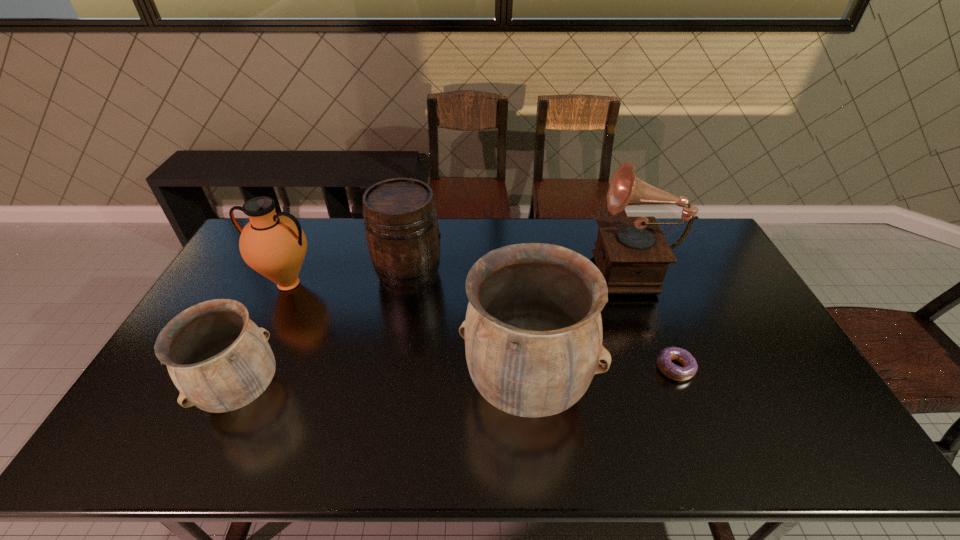
At what (x,y) coordinates should I click in order to perform the action: click on vacant space located 0.140m on the horn of the record player. Please return your answer as a coordinate pair (x, y). This screenshot has width=960, height=540. Looking at the image, I should click on tap(550, 266).

At what (x,y) coordinates should I click in order to perform the action: click on vacant space situated 0.360m on the horn of the record player. Please return your answer as a coordinate pair (x, y). This screenshot has width=960, height=540. Looking at the image, I should click on coord(487,266).

Locate an element on the screen. This screenshot has height=540, width=960. free spot located on the horn of the record player is located at coordinates (541, 266).

I want to click on vacant space situated on the side of the cider near the bung hole, so click(x=511, y=274).

Where is `vacant space located on the left of the shortest object`? This screenshot has width=960, height=540. vacant space located on the left of the shortest object is located at coordinates (580, 368).

Identify the location of vacant space positioned on the front of the pitcher. (270, 323).

Locate an element on the screen. The width and height of the screenshot is (960, 540). record player located in the far edge section of the desktop is located at coordinates (632, 253).

Locate an element on the screen. The image size is (960, 540). cider located at the far edge is located at coordinates (401, 225).

Where is `urn that is at the left edge`? The width and height of the screenshot is (960, 540). urn that is at the left edge is located at coordinates (219, 359).

Where is `pitcher present at the left edge`? pitcher present at the left edge is located at coordinates (274, 245).